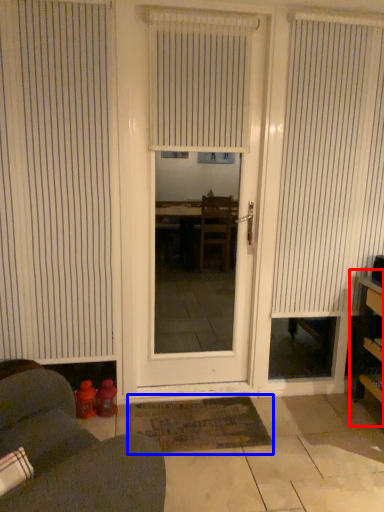
Question: Which point is closer to the camera, bookshelf (highlighted by a red box) or doormat (highlighted by a blue box)?

Choices:
 (A) bookshelf
 (B) doormat

Answer: (A)